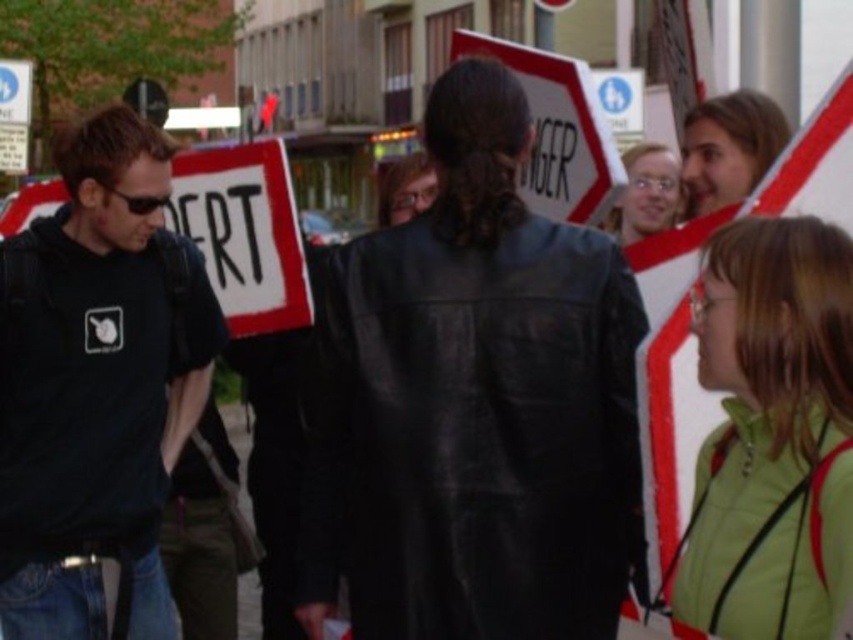
You are a photographer trying to capture a candid shot of the black leather jacket at center and the light brown hair at upper right. Given that your camera has a maximum focus range of 4 feet, will you be able to capture both subjects in focus simultaneously?

The black leather jacket at center is 4.23 feet from the light brown hair at upper right. Since the distance between them exceeds the camera maximum focus range of 4 feet, you cannot capture both subjects in focus simultaneously.

You are a photographer trying to capture a clear shot of both the black leather jacket at center and the matte black jacket at upper right. Since you want to ensure both are visible in the frame, does the height difference between them affect your ability to see both jackets fully?

The black leather jacket at center is taller than the matte black jacket at upper right, so the photographer can position the camera to include both jackets without one blocking the other due to the height difference.